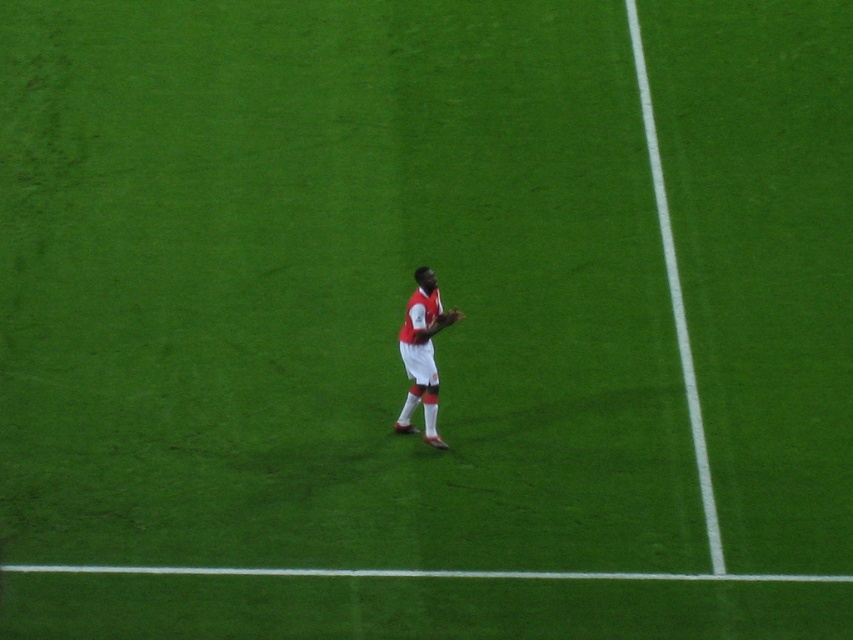
Question: Does white matte soccer player at center lie behind brown leather glove at center?

Choices:
 (A) no
 (B) yes

Answer: (A)

Question: Is white matte soccer player at center positioned behind brown leather glove at center?

Choices:
 (A) no
 (B) yes

Answer: (A)

Question: Which object appears closest to the camera in this image?

Choices:
 (A) white matte soccer player at center
 (B) brown leather glove at center

Answer: (A)

Question: Among these objects, which one is nearest to the camera?

Choices:
 (A) brown leather glove at center
 (B) white matte soccer player at center

Answer: (B)

Question: Which point is closer to the camera?

Choices:
 (A) (415, 364)
 (B) (445, 323)

Answer: (B)

Question: Does white matte soccer player at center come in front of brown leather glove at center?

Choices:
 (A) yes
 (B) no

Answer: (A)